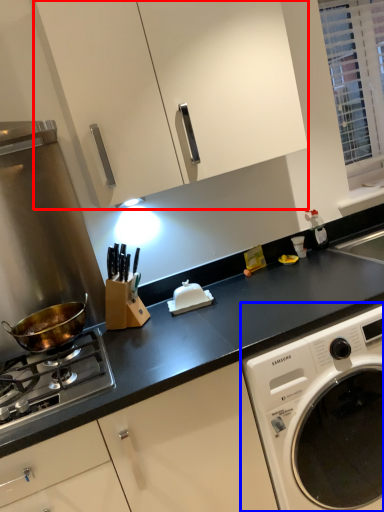
Question: Among these objects, which one is nearest to the camera, cabinetry (highlighted by a red box) or washing machine (highlighted by a blue box)?

Choices:
 (A) cabinetry
 (B) washing machine

Answer: (B)